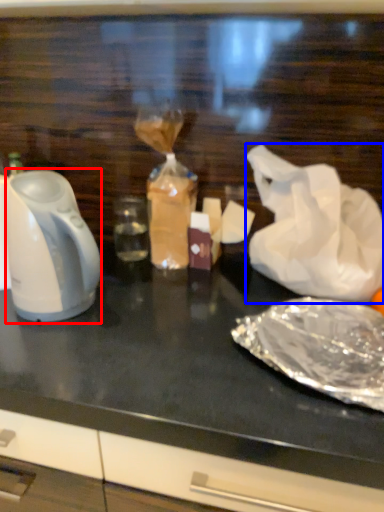
Question: Which object appears farthest to the camera in this image, kettle (highlighted by a red box) or plastic bag (highlighted by a blue box)?

Choices:
 (A) kettle
 (B) plastic bag

Answer: (B)